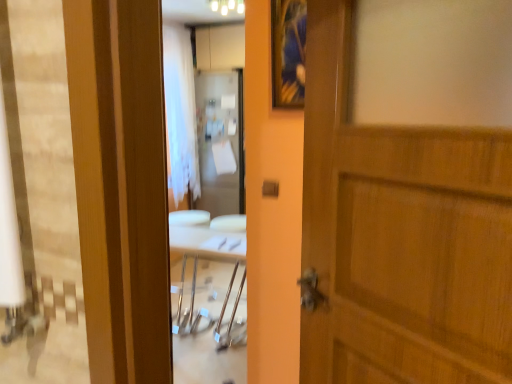
Question: Is white glossy light fixture at upper center facing away from white sheer curtain at center?

Choices:
 (A) yes
 (B) no

Answer: (B)

Question: Can you see white glossy light fixture at upper center touching white sheer curtain at center?

Choices:
 (A) no
 (B) yes

Answer: (A)

Question: Considering the relative positions of white glossy light fixture at upper center and white sheer curtain at center in the image provided, is white glossy light fixture at upper center to the right of white sheer curtain at center from the viewer's perspective?

Choices:
 (A) yes
 (B) no

Answer: (A)

Question: From a real-world perspective, is white glossy light fixture at upper center positioned under white sheer curtain at center based on gravity?

Choices:
 (A) no
 (B) yes

Answer: (A)

Question: Is white glossy light fixture at upper center positioned before white sheer curtain at center?

Choices:
 (A) yes
 (B) no

Answer: (A)

Question: Looking at their shapes, would you say white sheer curtain at center is wider or thinner than wooden framed picture at upper center?

Choices:
 (A) thin
 (B) wide

Answer: (B)

Question: Visually, is white sheer curtain at center positioned to the left or to the right of wooden framed picture at upper center?

Choices:
 (A) left
 (B) right

Answer: (A)

Question: Relative to wooden framed picture at upper center, is white sheer curtain at center in front or behind?

Choices:
 (A) behind
 (B) front

Answer: (A)

Question: Do you think white sheer curtain at center is within wooden framed picture at upper center, or outside of it?

Choices:
 (A) inside
 (B) outside

Answer: (B)

Question: Which is correct: white glossy light fixture at upper center is inside wooden door at center, or outside of it?

Choices:
 (A) outside
 (B) inside

Answer: (A)

Question: Does point (234, 3) appear closer or farther from the camera than point (416, 187)?

Choices:
 (A) closer
 (B) farther

Answer: (B)

Question: From a real-world perspective, relative to wooden door at center, is white glossy light fixture at upper center vertically above or below?

Choices:
 (A) above
 (B) below

Answer: (A)

Question: From the image's perspective, relative to wooden door at center, is white glossy light fixture at upper center above or below?

Choices:
 (A) above
 (B) below

Answer: (A)

Question: Considering the relative positions of wooden framed picture at upper center and white sheer curtain at center in the image provided, is wooden framed picture at upper center to the left or to the right of white sheer curtain at center?

Choices:
 (A) left
 (B) right

Answer: (B)

Question: From a real-world perspective, is wooden framed picture at upper center above or below white sheer curtain at center?

Choices:
 (A) above
 (B) below

Answer: (A)